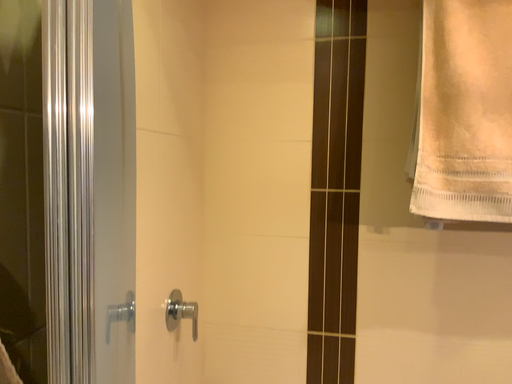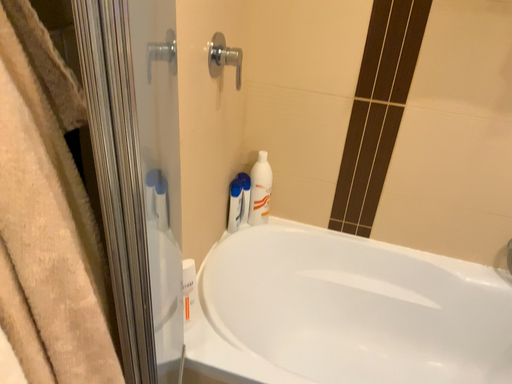
Question: How did the camera likely rotate when shooting the video?

Choices:
 (A) rotated upward
 (B) rotated downward

Answer: (B)